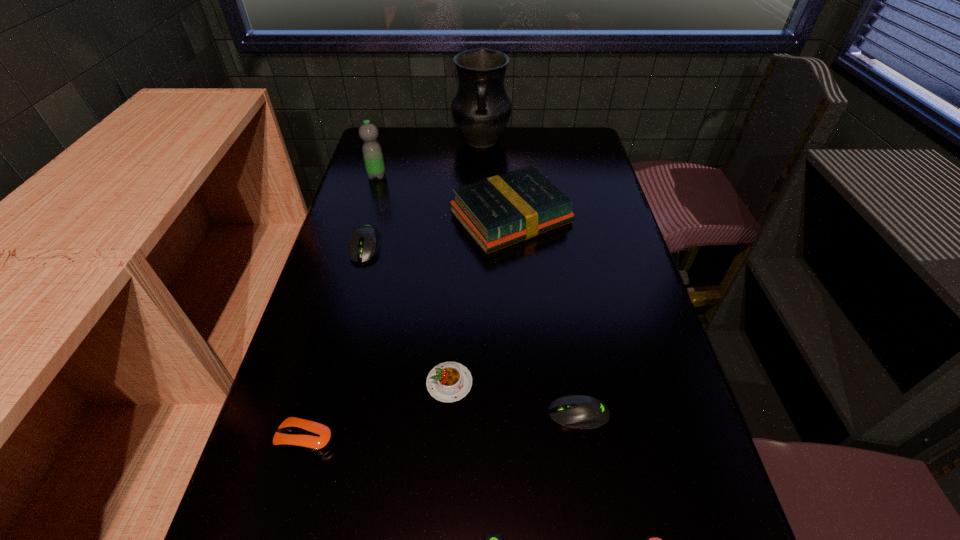
I want to click on black pitcher, so click(x=481, y=109).

Identify the location of the farthest object. Image resolution: width=960 pixels, height=540 pixels. (481, 109).

This screenshot has height=540, width=960. In order to click on water bottle in this screenshot , I will do `click(368, 132)`.

Find the location of `green water bottle`. green water bottle is located at coordinates (368, 132).

Locate an element on the screen. hardback book is located at coordinates (499, 211).

Locate an element on the screen. The image size is (960, 540). the seventh shortest object is located at coordinates (499, 211).

Locate an element on the screen. The width and height of the screenshot is (960, 540). the farthest gray computer mouse is located at coordinates (365, 241).

At what (x,y) coordinates should I click in order to perform the action: click on the sixth shortest object. Please return your answer as a coordinate pair (x, y). This screenshot has width=960, height=540. Looking at the image, I should click on (365, 241).

This screenshot has height=540, width=960. Find the location of `the rightmost gray computer mouse`. the rightmost gray computer mouse is located at coordinates (575, 411).

Find the location of `the second smallest gray computer mouse`. the second smallest gray computer mouse is located at coordinates (575, 411).